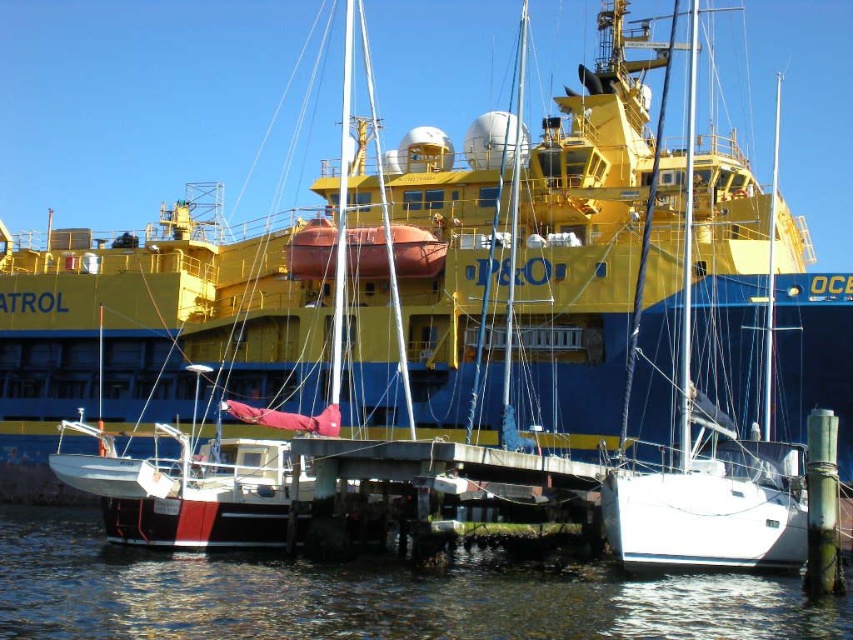
Who is more distant from viewer, (598,604) or (607,472)?

The point (607,472) is more distant.

In the scene shown: Which of these two, clear water at lower center or white matte sailboat at center, stands shorter?

Standing shorter between the two is clear water at lower center.

Which is in front, point (96, 538) or point (766, 401)?

Positioned in front is point (766, 401).

Locate an element on the screen. clear water at lower center is located at coordinates (364, 596).